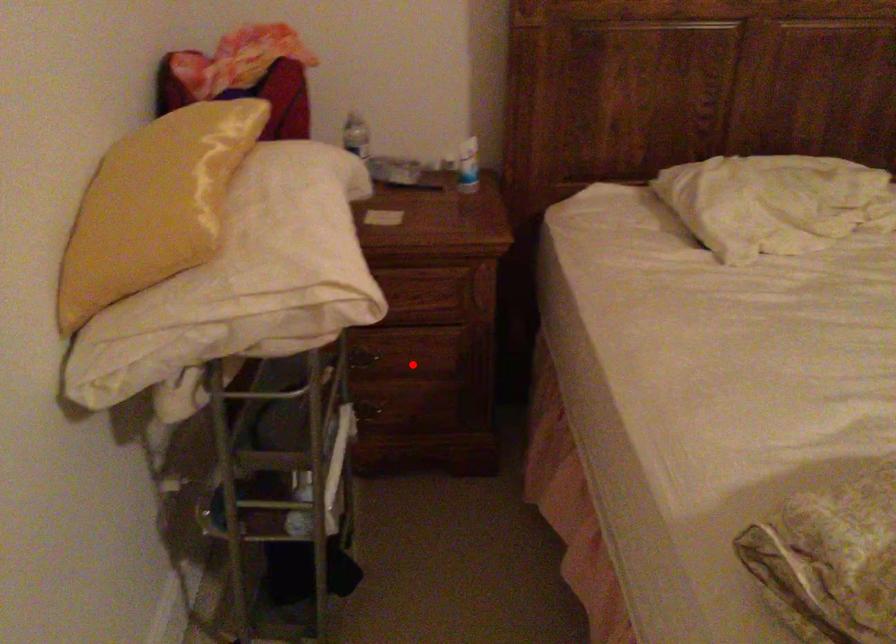
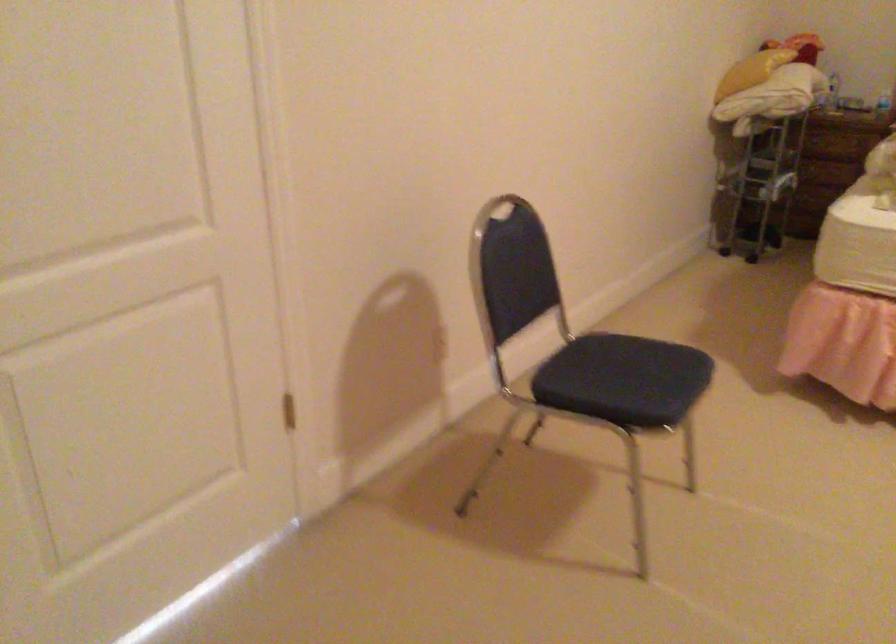
Question: I am providing you with two images of the same scene from different viewpoints. A red point is marked on the first image. Is the red point's position out of view in image 2?

Choices:
 (A) Yes
 (B) No

Answer: (A)